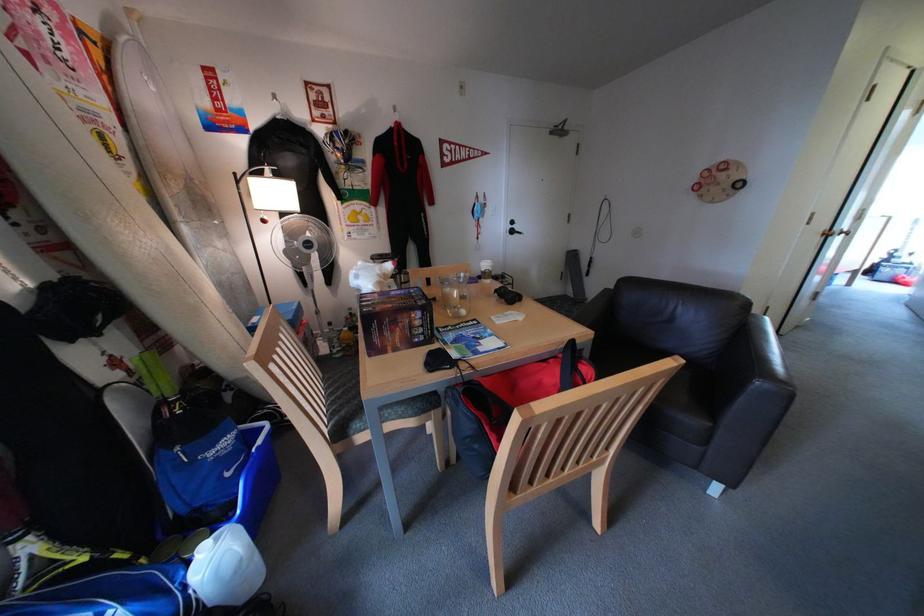
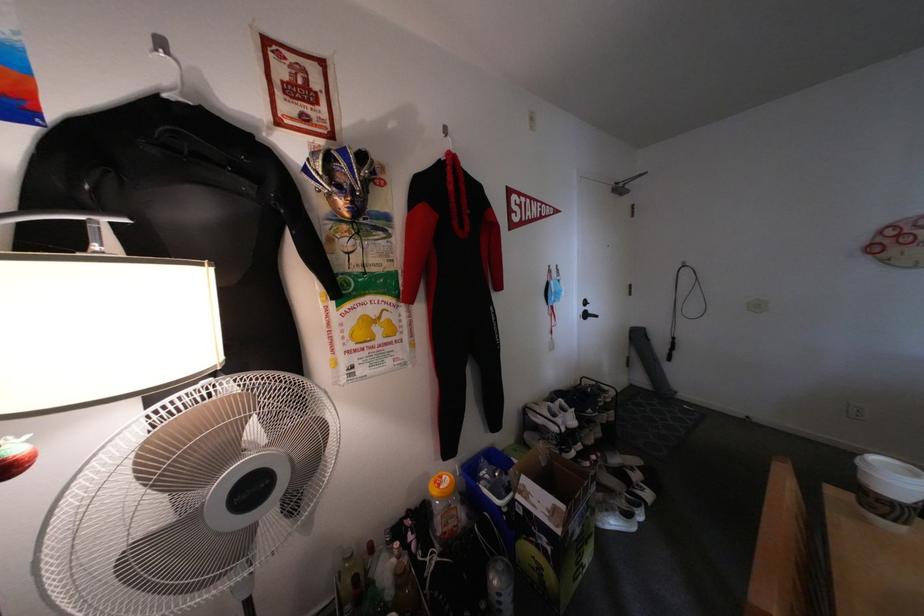
Which direction would the cameraman need to move to produce the second image?

The cameraman moved toward left, forward.